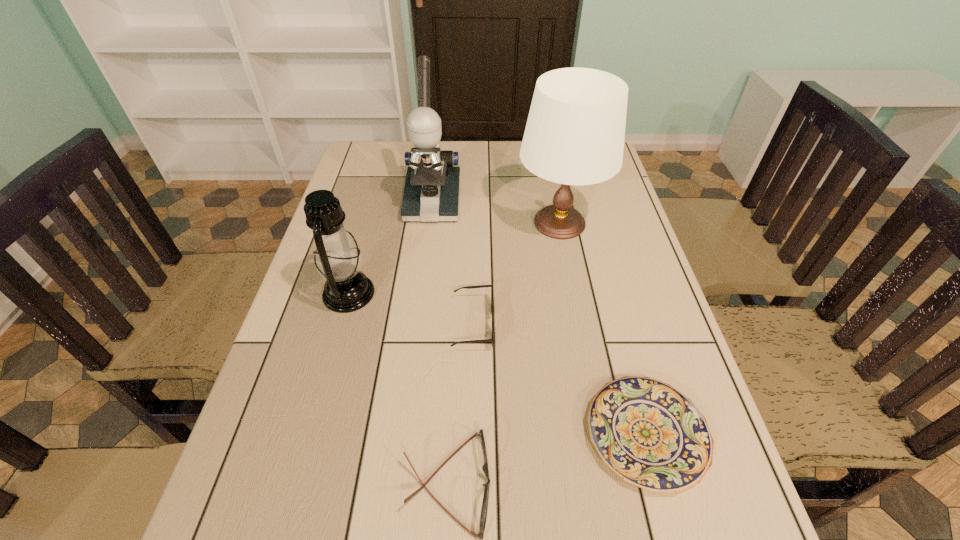
I want to click on microscope, so click(431, 193).

Where is `lamp`? lamp is located at coordinates (575, 131).

Where is `the fourth shortest object`? This screenshot has width=960, height=540. the fourth shortest object is located at coordinates click(x=337, y=259).

Where is `the leftmost object`? The width and height of the screenshot is (960, 540). the leftmost object is located at coordinates (337, 259).

In order to click on sunglasses in this screenshot , I will do `click(479, 286)`.

At what (x,y) coordinates should I click in order to perform the action: click on plate. Please return your answer as a coordinate pair (x, y). Looking at the image, I should click on [x=651, y=435].

Locate an element on the screen. free space located 0.080m on the left of the microscope is located at coordinates (379, 202).

Identify the location of vacant space located 0.380m on the left of the lamp. The height and width of the screenshot is (540, 960). (384, 223).

Locate an element on the screen. This screenshot has height=540, width=960. vacant point located 0.240m on the back of the oil lamp is located at coordinates (371, 214).

Find the location of `vacant space situated 0.170m on the front-facing side of the sunglasses`. vacant space situated 0.170m on the front-facing side of the sunglasses is located at coordinates (566, 324).